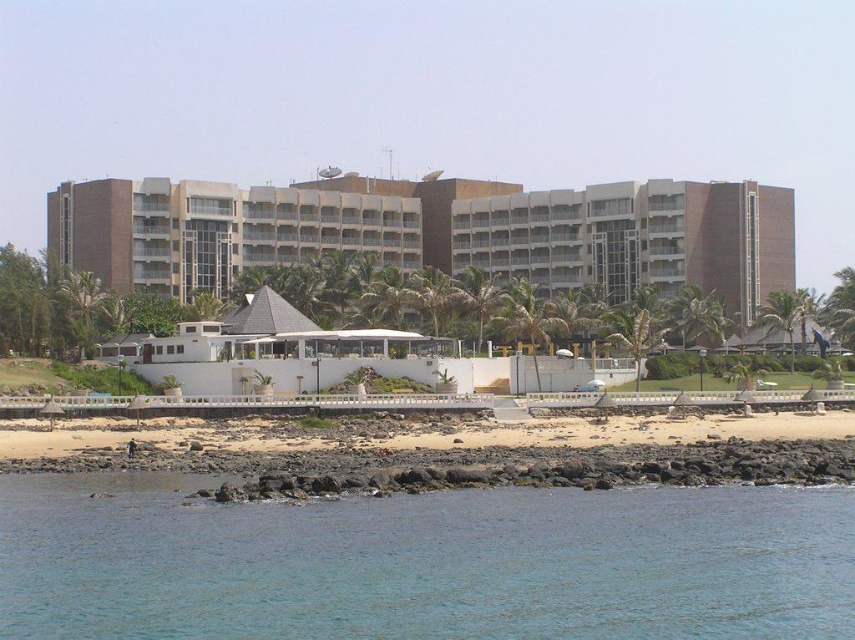
Can you confirm if brown concrete building at center is positioned above brown sand at lower center?

Yes.

Is point (540, 276) positioned behind point (475, 449)?

That is True.

Identify the location of brown concrete building at center. (434, 232).

Describe the element at coordinates (423, 563) in the screenshot. I see `clear blue water at lower center` at that location.

Is point (575, 545) behind point (722, 428)?

No, (575, 545) is in front of (722, 428).

At what (x,y) coordinates should I click in order to perform the action: click on clear blue water at lower center. Please return your answer as a coordinate pair (x, y). The width and height of the screenshot is (855, 640). Looking at the image, I should click on (423, 563).

Identify the location of clear blue water at lower center. Image resolution: width=855 pixels, height=640 pixels. (423, 563).

Between clear blue water at lower center and brown concrete building at center, which one appears on the left side from the viewer's perspective?

brown concrete building at center

This screenshot has height=640, width=855. What do you see at coordinates (423, 563) in the screenshot? I see `clear blue water at lower center` at bounding box center [423, 563].

Where is `clear blue water at lower center`? The width and height of the screenshot is (855, 640). clear blue water at lower center is located at coordinates (423, 563).